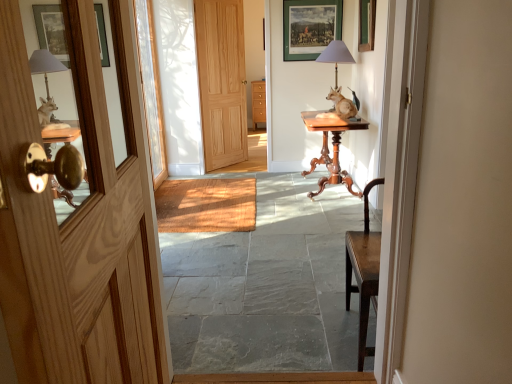
Question: Does natural wood door at center, arranged as the 2th door when viewed from the front, appear on the right side of mahogany wood table at center?

Choices:
 (A) yes
 (B) no

Answer: (B)

Question: Is natural wood door at center, arranged as the 2th door when viewed from the front, further to the viewer compared to mahogany wood table at center?

Choices:
 (A) yes
 (B) no

Answer: (A)

Question: Could you tell me if natural wood door at center, arranged as the 2th door when viewed from the front, is turned towards mahogany wood table at center?

Choices:
 (A) yes
 (B) no

Answer: (A)

Question: Is natural wood door at center, the second door ordered from the bottom, far away from mahogany wood table at center?

Choices:
 (A) no
 (B) yes

Answer: (B)

Question: Does natural wood door at center, arranged as the 2th door when viewed from the front, contain mahogany wood table at center?

Choices:
 (A) yes
 (B) no

Answer: (B)

Question: In terms of width, does wooden at center look wider or thinner when compared to smooth stone floor at center?

Choices:
 (A) thin
 (B) wide

Answer: (A)

Question: Is wooden at center bigger or smaller than smooth stone floor at center?

Choices:
 (A) big
 (B) small

Answer: (B)

Question: Considering the relative positions of wooden at center and smooth stone floor at center in the image provided, is wooden at center to the left or to the right of smooth stone floor at center?

Choices:
 (A) right
 (B) left

Answer: (B)

Question: From the image's perspective, is wooden at center above or below smooth stone floor at center?

Choices:
 (A) above
 (B) below

Answer: (A)

Question: From the image's perspective, is wooden at center above or below matte green picture frame at upper center?

Choices:
 (A) below
 (B) above

Answer: (A)

Question: In the image, is wooden at center positioned in front of or behind matte green picture frame at upper center?

Choices:
 (A) front
 (B) behind

Answer: (A)

Question: Considering the relative positions of wooden at center and matte green picture frame at upper center in the image provided, is wooden at center to the left or to the right of matte green picture frame at upper center?

Choices:
 (A) left
 (B) right

Answer: (A)

Question: From their relative heights in the image, would you say wooden at center is taller or shorter than matte green picture frame at upper center?

Choices:
 (A) short
 (B) tall

Answer: (A)

Question: Would you say clear glass door at center is inside or outside smooth stone floor at center?

Choices:
 (A) inside
 (B) outside

Answer: (B)

Question: Based on their sizes in the image, would you say clear glass door at center is bigger or smaller than smooth stone floor at center?

Choices:
 (A) big
 (B) small

Answer: (B)